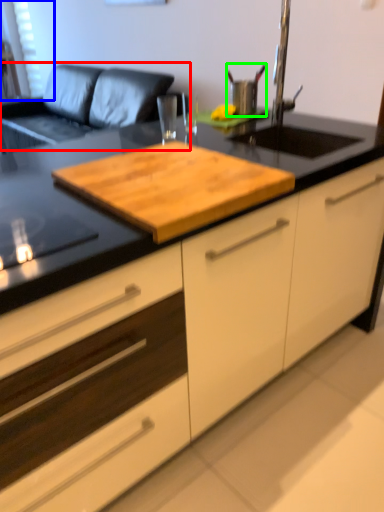
Question: Which object is the farthest from couch (highlighted by a red box)? Choose among these: window screen (highlighted by a blue box) or appliance (highlighted by a green box).

Choices:
 (A) window screen
 (B) appliance

Answer: (B)